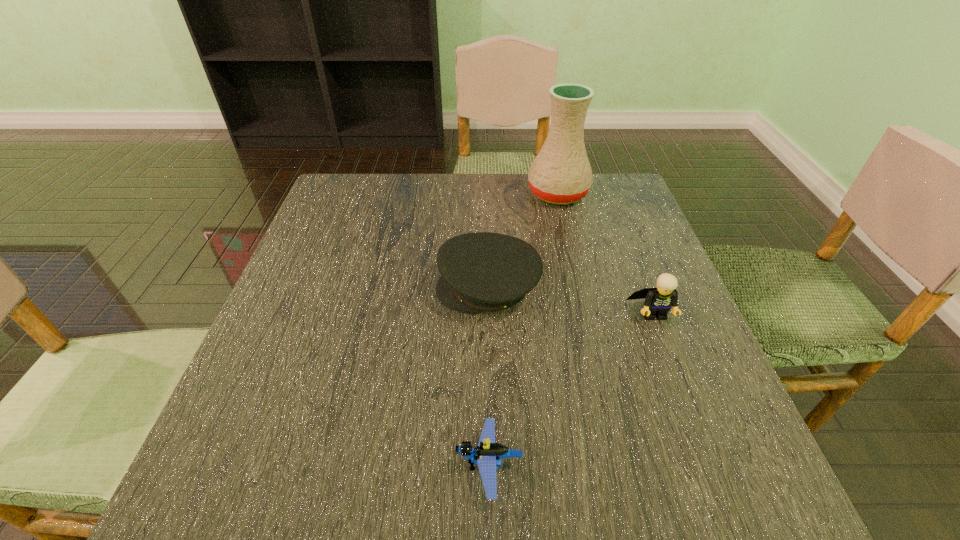
Image resolution: width=960 pixels, height=540 pixels. What are the coordinates of `free space between the beret and the farther Lego` in the screenshot? It's located at (571, 301).

The height and width of the screenshot is (540, 960). I want to click on blank region between the nearest object and the beret, so click(489, 377).

The image size is (960, 540). What are the coordinates of `vacant point located between the beret and the left Lego` in the screenshot? It's located at click(x=489, y=377).

The height and width of the screenshot is (540, 960). In order to click on the third closest object to the beret in this screenshot , I will do `click(488, 454)`.

Locate which object ranks in proximity to the farther Lego. Please provide its 2D coordinates. Your answer should be formatted as a tuple, i.e. [(x, y)], where the tuple contains the x and y coordinates of a point satisfying the conditions above.

[(483, 271)]